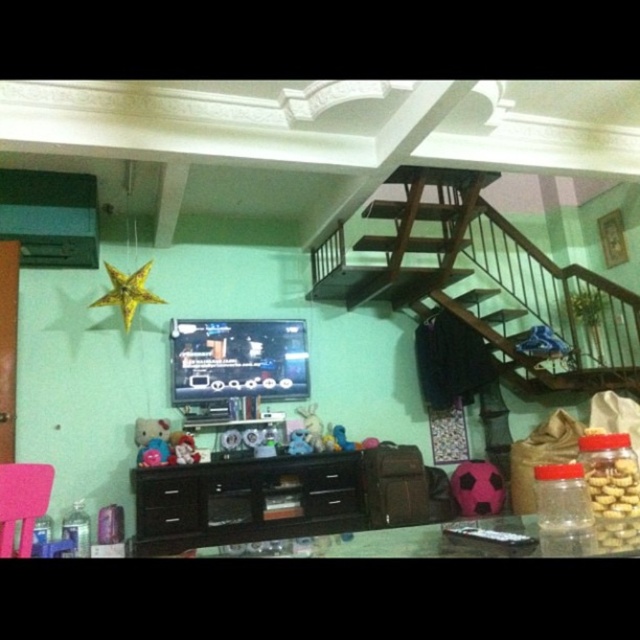
Can you confirm if wooden stairs at upper center is thinner than black glossy entertainment center at center?

No, wooden stairs at upper center is not thinner than black glossy entertainment center at center.

Who is lower down, wooden stairs at upper center or black glossy entertainment center at center?

Positioned lower is black glossy entertainment center at center.

The width and height of the screenshot is (640, 640). Describe the element at coordinates (490, 276) in the screenshot. I see `wooden stairs at upper center` at that location.

The image size is (640, 640). I want to click on wooden stairs at upper center, so click(490, 276).

Which of these two, wooden stairs at upper center or pink fabric chair at lower left, stands taller?

Standing taller between the two is wooden stairs at upper center.

In the scene shown: Who is more forward, (556, 282) or (29, 508)?

Point (29, 508)

Locate an element on the screen. wooden stairs at upper center is located at coordinates (490, 276).

Can you confirm if black glossy entertainment center at center is smaller than plush pink teddy bear at center?

Incorrect, black glossy entertainment center at center is not smaller in size than plush pink teddy bear at center.

Does black glossy entertainment center at center lie behind plush pink teddy bear at center?

No, black glossy entertainment center at center is closer to the viewer.

At what (x,y) coordinates should I click in order to perform the action: click on black glossy entertainment center at center. Please return your answer as a coordinate pair (x, y). The height and width of the screenshot is (640, 640). Looking at the image, I should click on (244, 500).

In order to click on black glossy entertainment center at center in this screenshot , I will do `click(244, 500)`.